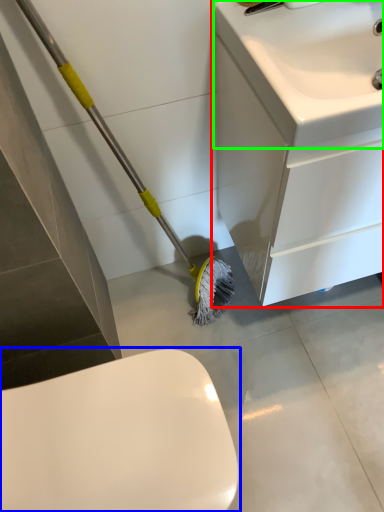
Question: Estimate the real-world distances between objects in this image. Which object is closer to bathroom cabinet (highlighted by a red box), toilet (highlighted by a blue box) or sink (highlighted by a green box)?

Choices:
 (A) toilet
 (B) sink

Answer: (B)